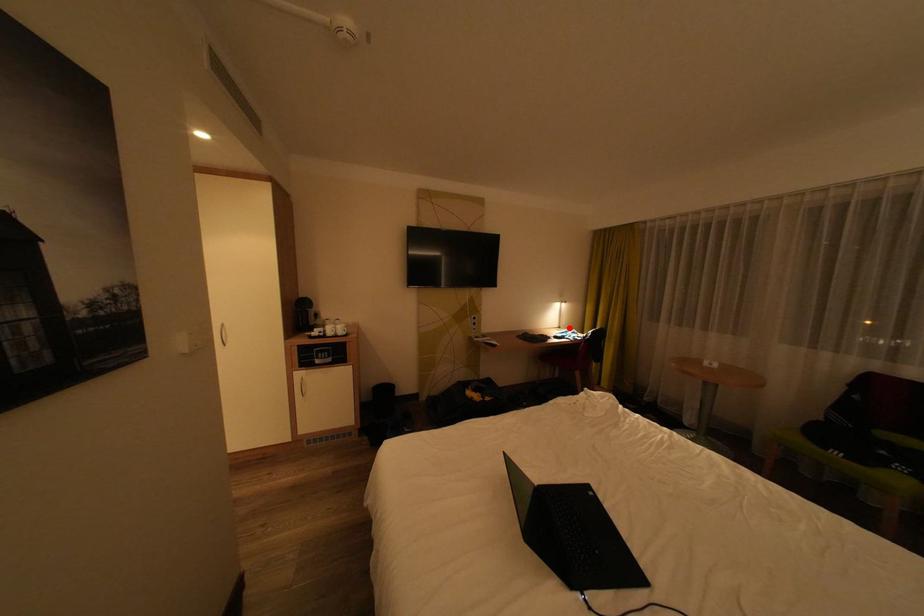
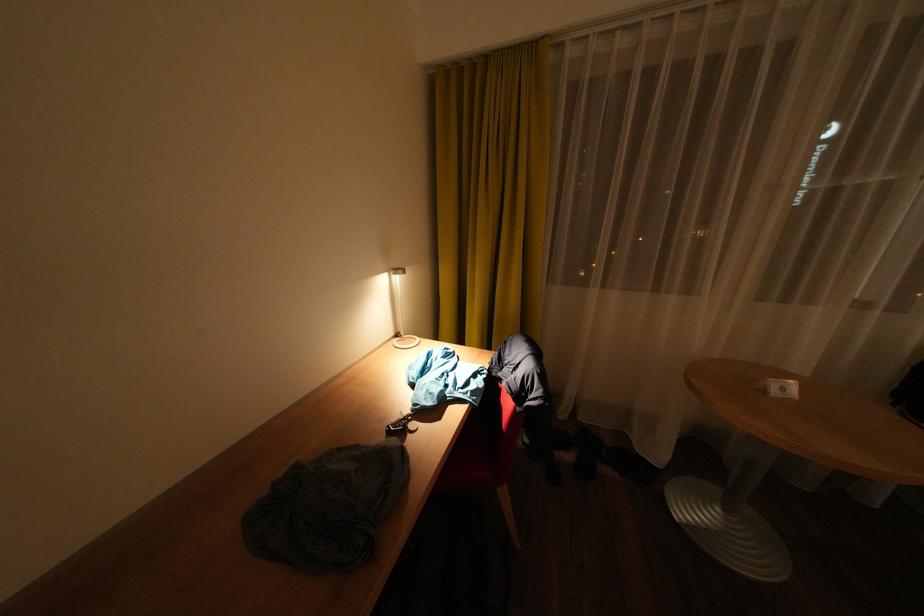
Find the pixel in the second image that matches the highlighted location in the first image.

(407, 336)